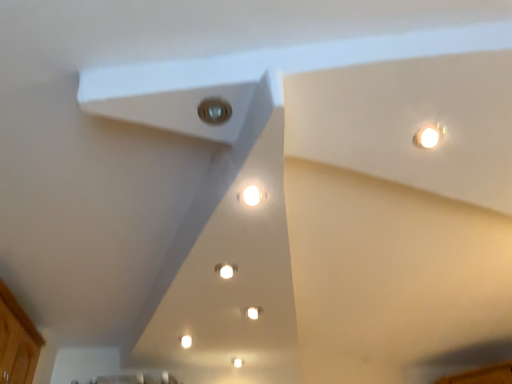
Question: From the image's perspective, is white glossy light at center, placed as the 1th light when sorted from back to front, positioned above or below matte glass light at center, which is the 1th light from top to bottom?

Choices:
 (A) above
 (B) below

Answer: (B)

Question: Is white glossy light at center, marked as the second light in a front-to-back arrangement, wider or thinner than matte glass light at center, which is the 2th light from bottom to top?

Choices:
 (A) thin
 (B) wide

Answer: (A)

Question: Estimate the real-world distances between objects in this image. Which object is closer to the white glossy light at center, marked as the second light in a front-to-back arrangement?

Choices:
 (A) wooden cabinet at lower left
 (B) matte glass light at center, arranged as the first light when viewed from the front

Answer: (B)

Question: Estimate the real-world distances between objects in this image. Which object is closer to the white glossy light at center, which appears as the first light when ordered from the bottom?

Choices:
 (A) wooden cabinet at lower left
 (B) matte glass light at center, which is the 2th light from bottom to top

Answer: (B)